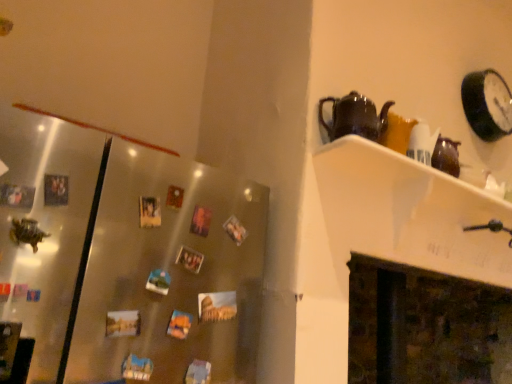
Question: From the image's perspective, does satin metallic fridge at left appear higher than white glossy shelf at upper right?

Choices:
 (A) yes
 (B) no

Answer: (B)

Question: Can you confirm if satin metallic fridge at left is smaller than white glossy shelf at upper right?

Choices:
 (A) yes
 (B) no

Answer: (B)

Question: Can you confirm if satin metallic fridge at left is shorter than white glossy shelf at upper right?

Choices:
 (A) no
 (B) yes

Answer: (A)

Question: Would you say satin metallic fridge at left is a long distance from white glossy shelf at upper right?

Choices:
 (A) no
 (B) yes

Answer: (A)

Question: Is satin metallic fridge at left closer to camera compared to white glossy shelf at upper right?

Choices:
 (A) yes
 (B) no

Answer: (A)

Question: Is satin metallic fridge at left positioned beyond the bounds of white glossy shelf at upper right?

Choices:
 (A) yes
 (B) no

Answer: (A)

Question: Considering the relative sizes of dark brown stone fireplace at lower right and satin metallic fridge at left in the image provided, is dark brown stone fireplace at lower right bigger than satin metallic fridge at left?

Choices:
 (A) yes
 (B) no

Answer: (B)

Question: Is dark brown stone fireplace at lower right positioned with its back to satin metallic fridge at left?

Choices:
 (A) yes
 (B) no

Answer: (B)

Question: Is dark brown stone fireplace at lower right positioned beyond the bounds of satin metallic fridge at left?

Choices:
 (A) no
 (B) yes

Answer: (B)

Question: Is dark brown stone fireplace at lower right to the right of satin metallic fridge at left from the viewer's perspective?

Choices:
 (A) yes
 (B) no

Answer: (A)

Question: Are dark brown stone fireplace at lower right and satin metallic fridge at left making contact?

Choices:
 (A) yes
 (B) no

Answer: (B)

Question: Does dark brown stone fireplace at lower right have a smaller size compared to satin metallic fridge at left?

Choices:
 (A) no
 (B) yes

Answer: (B)

Question: Is the position of white glossy shelf at upper right less distant than that of dark brown stone fireplace at lower right?

Choices:
 (A) no
 (B) yes

Answer: (B)